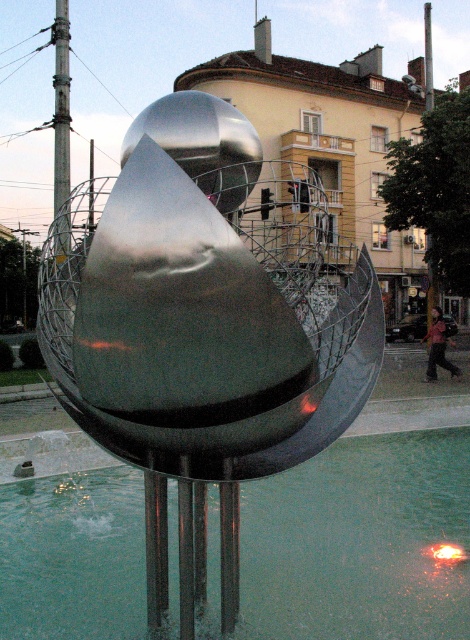
Which of these two, shiny metallic sculpture at center or clear glass water at center, stands shorter?

Standing shorter between the two is clear glass water at center.

Does point (362, 352) come in front of point (275, 525)?

Yes, point (362, 352) is closer to viewer.

Find the location of a particular element. The height and width of the screenshot is (640, 470). shiny metallic sculpture at center is located at coordinates (204, 324).